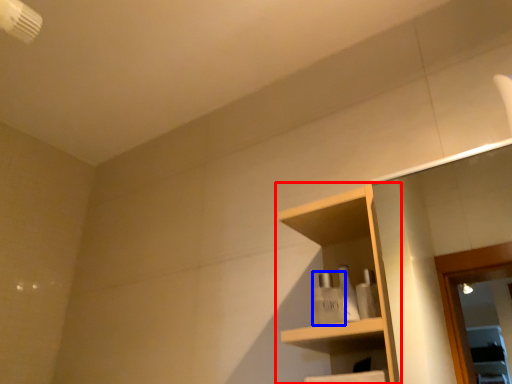
Question: Which object is further to the camera taking this photo, shelf (highlighted by a red box) or toiletry (highlighted by a blue box)?

Choices:
 (A) shelf
 (B) toiletry

Answer: (B)